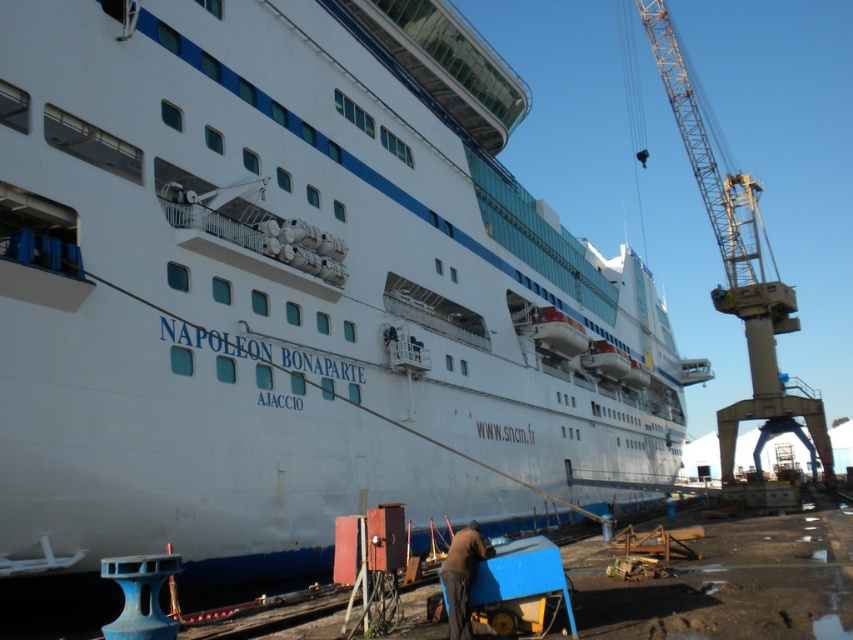
What do you see at coordinates (737, 264) in the screenshot?
I see `metallic yellow crane at right` at bounding box center [737, 264].

Is metallic yellow crane at right wider than brown leather jacket at lower center?

Yes.

What do you see at coordinates (737, 264) in the screenshot?
I see `metallic yellow crane at right` at bounding box center [737, 264].

Image resolution: width=853 pixels, height=640 pixels. What are the coordinates of `metallic yellow crane at right` in the screenshot? It's located at (737, 264).